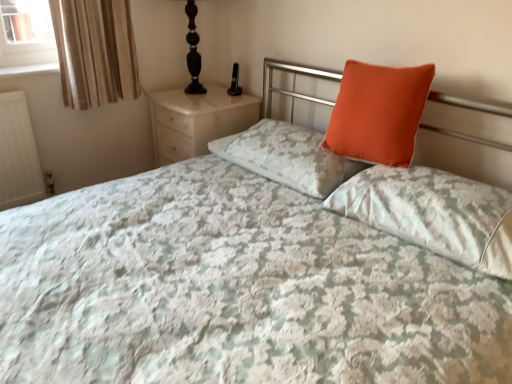
Question: Based on their positions, is orange fabric pillow at center, which is the 3th pillow from right to left, located to the left or right of black glass table lamp at upper left?

Choices:
 (A) right
 (B) left

Answer: (A)

Question: In the image, is orange fabric pillow at center, which is counted as the first pillow, starting from the left, positioned in front of or behind black glass table lamp at upper left?

Choices:
 (A) behind
 (B) front

Answer: (B)

Question: Estimate the real-world distances between objects in this image. Which object is closer to the beige striped fabric at upper left?

Choices:
 (A) orange matte pillow at upper right, the second pillow in the left-to-right sequence
 (B) orange fabric pillow at upper right, the 1th pillow viewed from the right
 (C) black glass table lamp at upper left
 (D) orange fabric pillow at center, which is the 3th pillow from right to left
 (E) white marble nightstand at upper left

Answer: (E)

Question: Estimate the real-world distances between objects in this image. Which object is closer to the orange matte pillow at upper right, the second pillow in the left-to-right sequence?

Choices:
 (A) beige striped fabric at upper left
 (B) white marble nightstand at upper left
 (C) orange fabric pillow at upper right, the 3th pillow when ordered from left to right
 (D) orange fabric pillow at center, which is counted as the first pillow, starting from the left
 (E) black glass table lamp at upper left

Answer: (D)